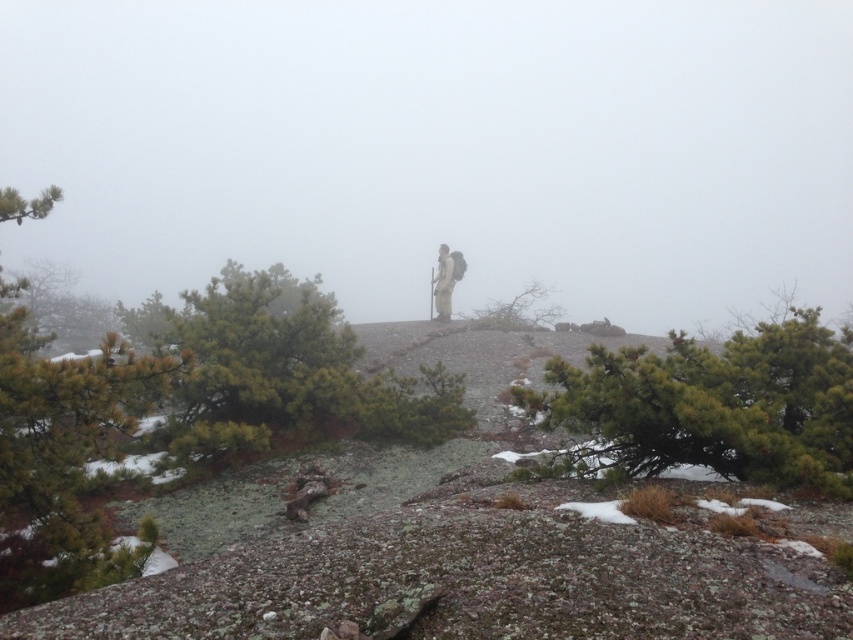
Can you confirm if green textured pine tree at center is positioned to the right of matte gray figure at center?

Incorrect, green textured pine tree at center is not on the right side of matte gray figure at center.

Can you confirm if green textured pine tree at center is thinner than matte gray figure at center?

In fact, green textured pine tree at center might be wider than matte gray figure at center.

Measure the distance between point [372,376] and camera.

A distance of 12.46 meters exists between point [372,376] and camera.

At what (x,y) coordinates should I click in order to perform the action: click on green textured pine tree at center. Please return your answer as a coordinate pair (x, y). The width and height of the screenshot is (853, 640). Looking at the image, I should click on (286, 371).

Which is above, green textured pine tree at lower right or green leafy tree at center?

green leafy tree at center is higher up.

Can you confirm if green textured pine tree at lower right is shorter than green leafy tree at center?

Yes, green textured pine tree at lower right is shorter than green leafy tree at center.

Which is in front, point (642, 417) or point (538, 300)?

Point (642, 417) is in front.

Find the location of a particular element. This screenshot has width=853, height=640. green textured pine tree at lower right is located at coordinates (711, 406).

Is point (379, 394) behind point (54, 499)?

Yes.

Does green textured pine tree at center appear on the right side of green matte pine tree at left?

Indeed, green textured pine tree at center is positioned on the right side of green matte pine tree at left.

Where is `green textured pine tree at center`? green textured pine tree at center is located at coordinates (286, 371).